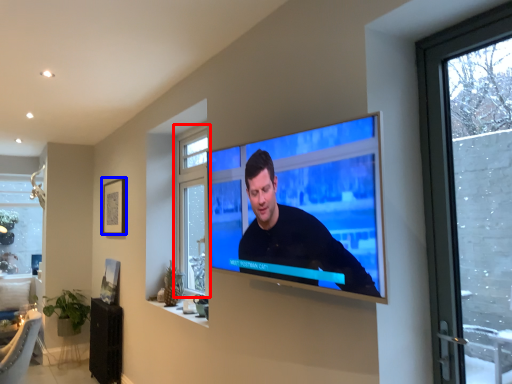
Question: Among these objects, which one is nearest to the camera, window (highlighted by a red box) or picture frame (highlighted by a blue box)?

Choices:
 (A) window
 (B) picture frame

Answer: (A)